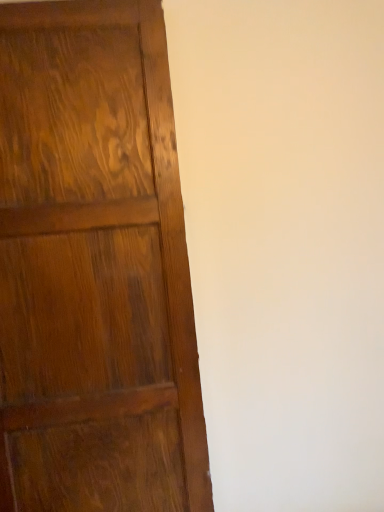
Question: Should I look upward or downward to see shiny brown wood door at upper left?

Choices:
 (A) up
 (B) down

Answer: (B)